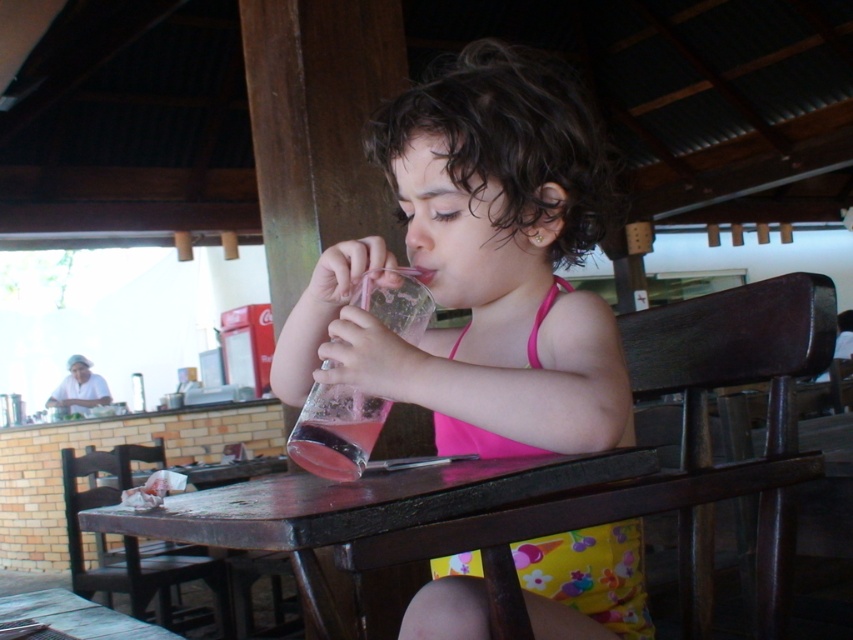
Does pink matte swimsuit at center have a larger size compared to wooden table at center?

Indeed, pink matte swimsuit at center has a larger size compared to wooden table at center.

Who is taller, pink matte swimsuit at center or wooden table at center?

pink matte swimsuit at center

This screenshot has height=640, width=853. I want to click on pink matte swimsuit at center, so click(480, 266).

You are a GUI agent. You are given a task and a screenshot of the screen. Output one action in this format:
    pyautogui.click(x=<x>, y=<y>)
    Task: Click on the pink matte swimsuit at center
    This screenshot has height=640, width=853.
    Given the screenshot: What is the action you would take?
    pyautogui.click(x=480, y=266)

Measure the distance between wooden table at center and wooden table at lower left.

33.22 inches

Which is more to the left, wooden table at center or wooden table at lower left?

From the viewer's perspective, wooden table at lower left appears more on the left side.

The width and height of the screenshot is (853, 640). Describe the element at coordinates (358, 509) in the screenshot. I see `wooden table at center` at that location.

Locate an element on the screen. wooden table at center is located at coordinates [358, 509].

Can you confirm if pink matte swimsuit at center is bigger than wooden table at lower left?

Correct, pink matte swimsuit at center is larger in size than wooden table at lower left.

Between pink matte swimsuit at center and wooden table at lower left, which one appears on the left side from the viewer's perspective?

wooden table at lower left

The width and height of the screenshot is (853, 640). What do you see at coordinates (480, 266) in the screenshot?
I see `pink matte swimsuit at center` at bounding box center [480, 266].

Where is `pink matte swimsuit at center`? pink matte swimsuit at center is located at coordinates (480, 266).